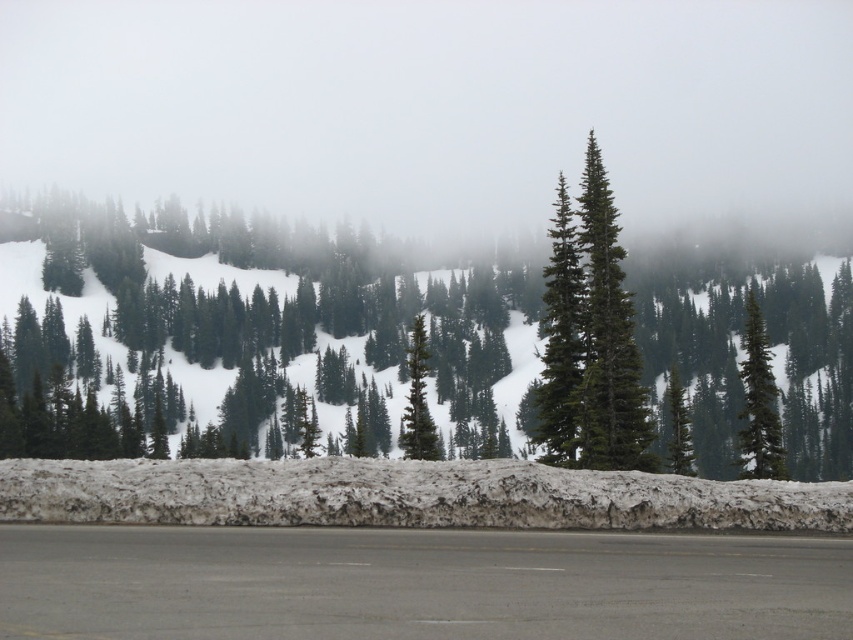
You are a delivery truck driver who needs to navigate the gray asphalt highway at lower center. There is a green matte evergreen tree at center in your path. Can you safely drive through this area?

The gray asphalt highway at lower center is located below the green matte evergreen tree at center, meaning the tree is positioned above the highway. Since the tree is not obstructing the road, you can safely drive through the gray asphalt highway at lower center.

Consider the image. You are standing at the snowbank edge in the wintry scene. You see two points marked in the image. Which point is closer to you, point (761, 432) or point (421, 380)?

Point (761, 432) is in front of point (421, 380), so it is closer to you.

You are standing at the edge of the gray asphalt highway at lower center and want to walk to a cabin located 15 meters away. Can you reach the cabin without crossing the highway?

The gray asphalt highway at lower center is 11.93 meters away from you. Since the cabin is 15 meters away, you can reach it without crossing the highway by going around it.